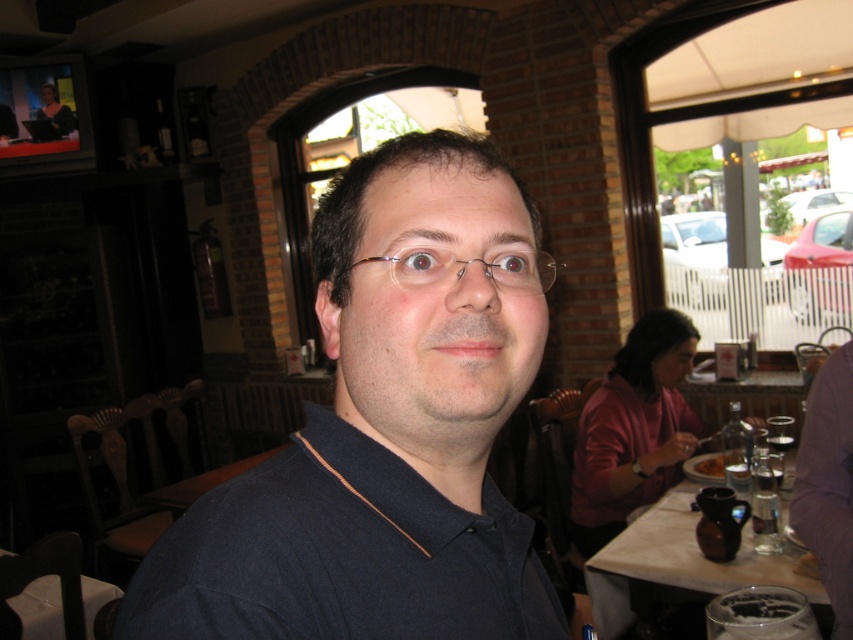
Between point (515, 365) and point (786, 435), which one is positioned in front?

Point (515, 365) is more forward.

At what (x,y) coordinates should I click in order to perform the action: click on dark blue fabric shirt at center. Please return your answer as a coordinate pair (x, y). The height and width of the screenshot is (640, 853). Looking at the image, I should click on (386, 429).

Locate an element on the screen. The width and height of the screenshot is (853, 640). dark blue fabric shirt at center is located at coordinates (386, 429).

Does white ceramic table at lower right have a smaller size compared to white glossy table at lower left?

Actually, white ceramic table at lower right might be larger than white glossy table at lower left.

Can you confirm if white ceramic table at lower right is thinner than white glossy table at lower left?

No.

Does point (694, 524) come closer to viewer compared to point (18, 600)?

Yes, it is in front of point (18, 600).

The image size is (853, 640). Find the location of `white ceramic table at lower right`. white ceramic table at lower right is located at coordinates (677, 566).

At what (x,y) coordinates should I click in order to perform the action: click on dark blue cotton polo shirt at center. Please return your answer as a coordinate pair (x, y). The height and width of the screenshot is (640, 853). Looking at the image, I should click on (340, 556).

This screenshot has height=640, width=853. I want to click on dark blue cotton polo shirt at center, so click(340, 556).

Where is `dark blue cotton polo shirt at center`? This screenshot has width=853, height=640. dark blue cotton polo shirt at center is located at coordinates (340, 556).